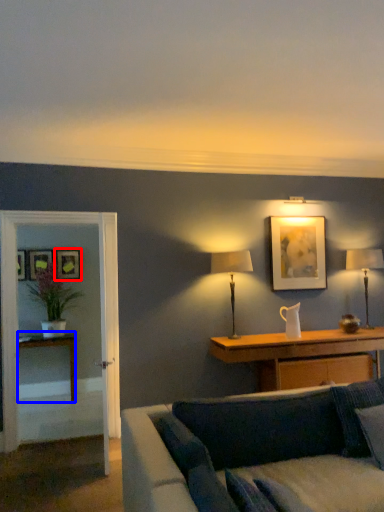
Question: Which object is further to the camera taking this photo, picture frame (highlighted by a red box) or table (highlighted by a blue box)?

Choices:
 (A) picture frame
 (B) table

Answer: (A)